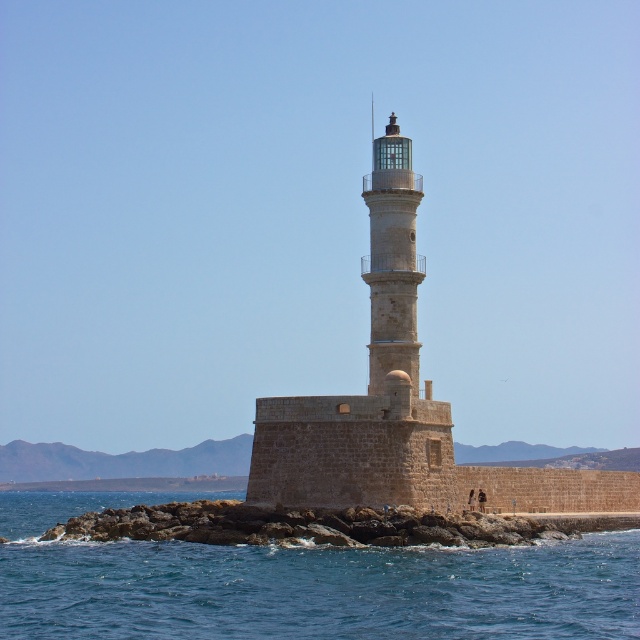
Between point (609, 588) and point (284, 451), which one is positioned behind?

Positioned behind is point (284, 451).

Is blue water at lower left closer to the viewer compared to beige stone lighthouse at center?

Yes, blue water at lower left is closer to the viewer.

This screenshot has height=640, width=640. What do you see at coordinates (301, 582) in the screenshot? I see `blue water at lower left` at bounding box center [301, 582].

Identify the location of blue water at lower left. The image size is (640, 640). (301, 582).

Is beige stone lighthouse at center wider than smooth stone lighthouse at center?

Correct, the width of beige stone lighthouse at center exceeds that of smooth stone lighthouse at center.

Is beige stone lighthouse at center to the left of smooth stone lighthouse at center from the viewer's perspective?

No, beige stone lighthouse at center is not to the left of smooth stone lighthouse at center.

The image size is (640, 640). Find the location of `beige stone lighthouse at center`. beige stone lighthouse at center is located at coordinates (369, 381).

Image resolution: width=640 pixels, height=640 pixels. Identify the location of beige stone lighthouse at center. (369, 381).

Between blue water at lower left and smooth stone lighthouse at center, which one has less height?

blue water at lower left is shorter.

Can you confirm if blue water at lower left is positioned to the right of smooth stone lighthouse at center?

No, blue water at lower left is not to the right of smooth stone lighthouse at center.

In order to click on blue water at lower left in this screenshot , I will do 301,582.

Locate an element on the screen. Image resolution: width=640 pixels, height=640 pixels. blue water at lower left is located at coordinates (301, 582).